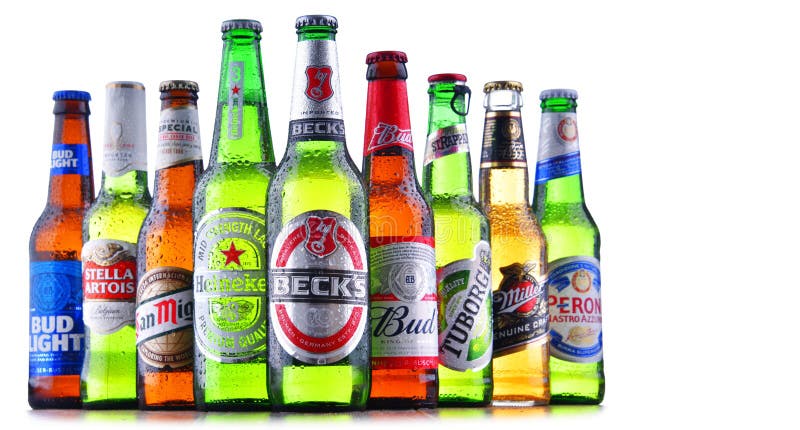
Identify the location of bottle lids. (76, 97), (126, 87), (174, 86), (242, 23), (312, 19), (382, 57), (441, 79), (505, 88), (558, 90).